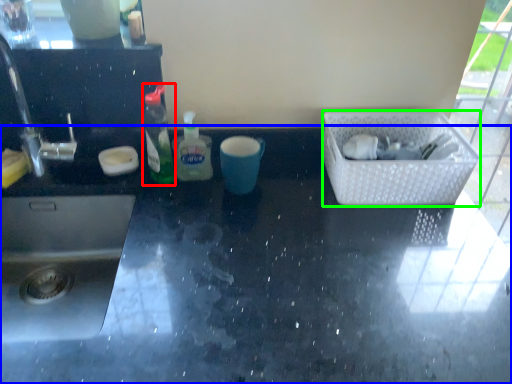
Question: Based on their relative distances, which object is nearer to bottle (highlighted by a red box)? Choose from countertop (highlighted by a blue box) and basket (highlighted by a green box).

Choices:
 (A) countertop
 (B) basket

Answer: (A)